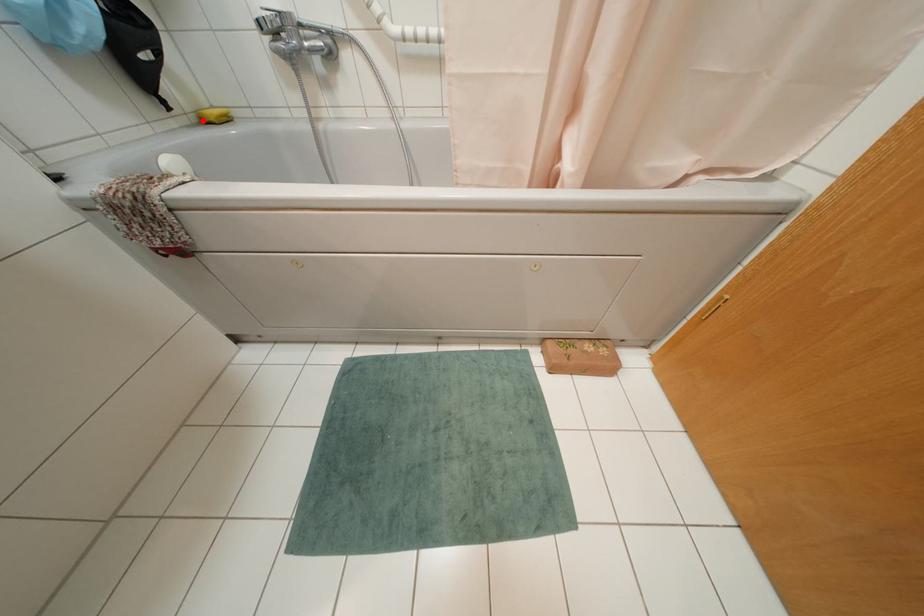
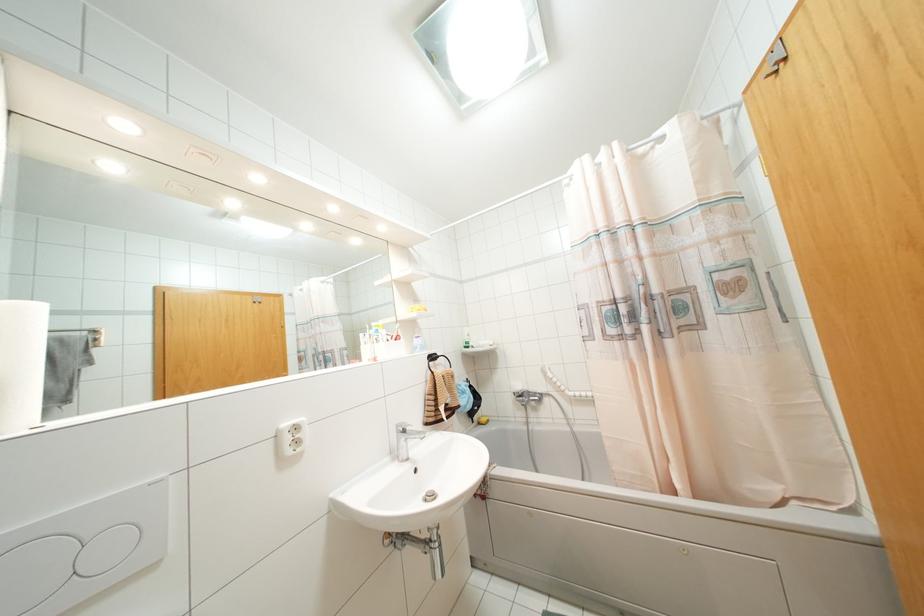
Question: I am providing you with two images of the same scene from different viewpoints. Given a red point in image1, look at the same physical point in image2. Is it:

Choices:
 (A) Closer to the viewpoint
 (B) Farther from the viewpoint

Answer: (B)